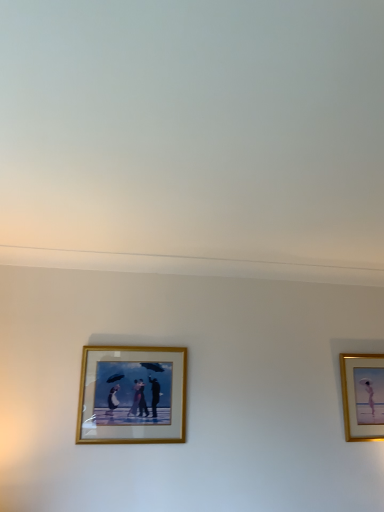
Question: From the image's perspective, is gold/glass picture frame at center, the second picture frame in the right-to-left sequence, above or below gold-framed picture at right, which ranks as the first picture frame in right-to-left order?

Choices:
 (A) below
 (B) above

Answer: (B)

Question: Is gold/glass picture frame at center, the second picture frame in the right-to-left sequence, spatially inside gold-framed picture at right, acting as the 2th picture frame starting from the front, or outside of it?

Choices:
 (A) outside
 (B) inside

Answer: (A)

Question: Considering their positions, is gold/glass picture frame at center, acting as the 1th picture frame starting from the left, located in front of or behind gold-framed picture at right, which ranks as the first picture frame in right-to-left order?

Choices:
 (A) front
 (B) behind

Answer: (A)

Question: In the image, is gold-framed picture at right, acting as the 2th picture frame starting from the front, on the left side or the right side of gold/glass picture frame at center, the second picture frame in the right-to-left sequence?

Choices:
 (A) right
 (B) left

Answer: (A)

Question: Considering the positions of point (354, 433) and point (124, 364), is point (354, 433) closer or farther from the camera than point (124, 364)?

Choices:
 (A) closer
 (B) farther

Answer: (B)

Question: Is gold-framed picture at right, which ranks as the first picture frame in right-to-left order, in front of or behind gold/glass picture frame at center, the second picture frame in the right-to-left sequence, in the image?

Choices:
 (A) behind
 (B) front

Answer: (A)

Question: Based on their sizes in the image, would you say gold-framed picture at right, acting as the 2th picture frame starting from the front, is bigger or smaller than gold/glass picture frame at center, which appears as the first picture frame when viewed from the front?

Choices:
 (A) small
 (B) big

Answer: (A)